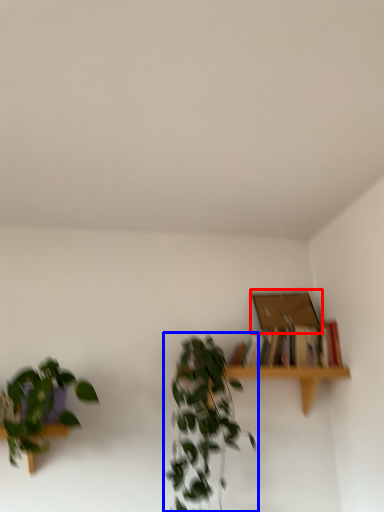
Question: Which object appears closest to the camera in this image, box (highlighted by a red box) or houseplant (highlighted by a blue box)?

Choices:
 (A) box
 (B) houseplant

Answer: (B)